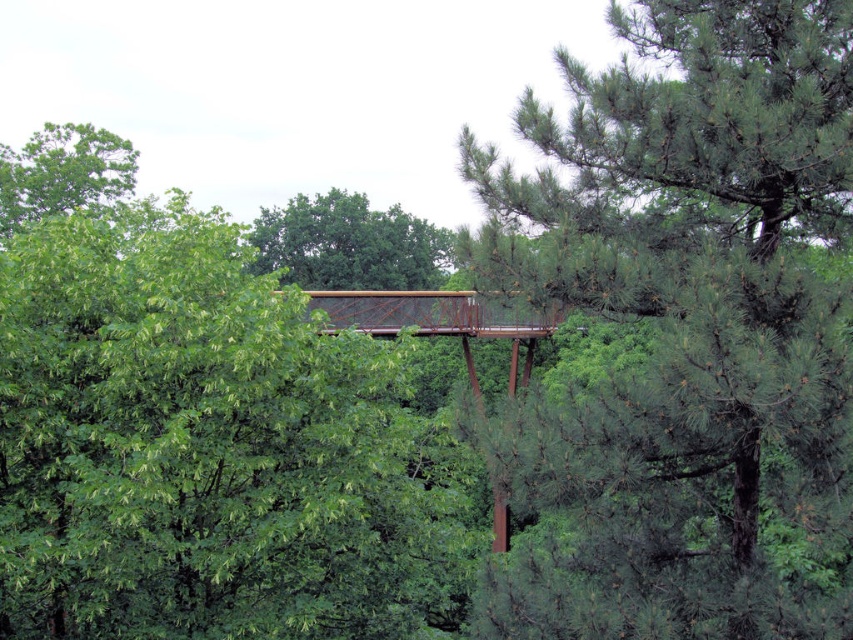
Question: Which object appears farthest from the camera in this image?

Choices:
 (A) green leafy tree at upper left
 (B) green matte tree at center

Answer: (A)

Question: Does green matte tree at center have a smaller size compared to green leafy tree at upper left?

Choices:
 (A) no
 (B) yes

Answer: (B)

Question: Among these points, which one is farthest from the camera?

Choices:
 (A) (381, 230)
 (B) (78, 141)
 (C) (605, 163)

Answer: (A)

Question: Is green pine tree at center below green matte tree at center?

Choices:
 (A) yes
 (B) no

Answer: (A)

Question: Based on their relative distances, which object is farther from the green pine tree at center?

Choices:
 (A) green matte tree at center
 (B) green leafy tree at upper left

Answer: (A)

Question: Is green pine tree at center to the right of green leafy tree at upper left from the viewer's perspective?

Choices:
 (A) yes
 (B) no

Answer: (A)